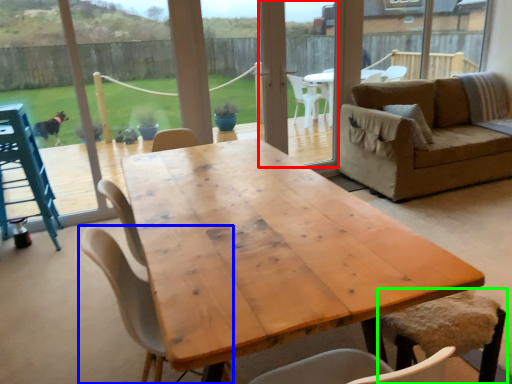
Question: Which object is positioned closest to screen door (highlighted by a red box)? Select from chair (highlighted by a blue box) and chair (highlighted by a green box).

Choices:
 (A) chair
 (B) chair

Answer: (B)